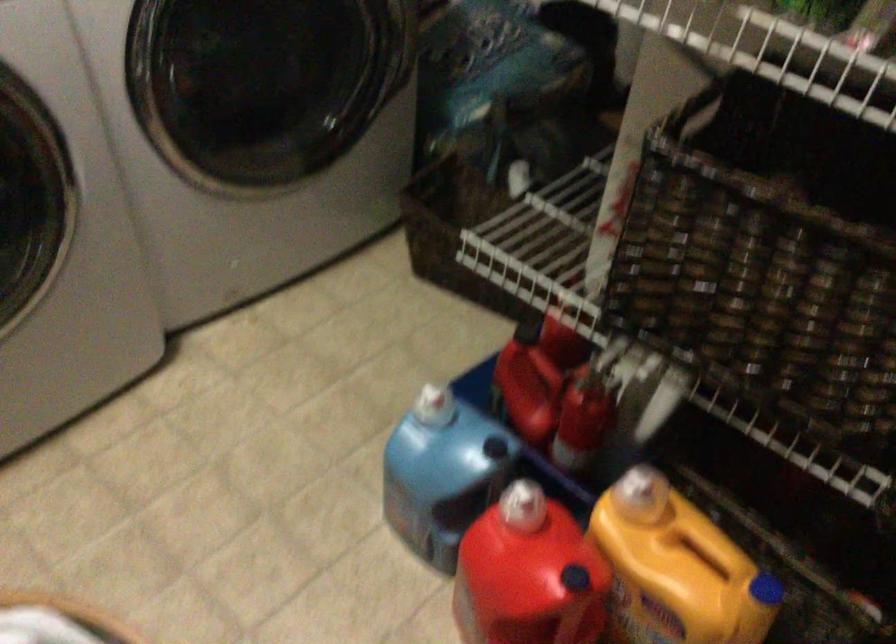
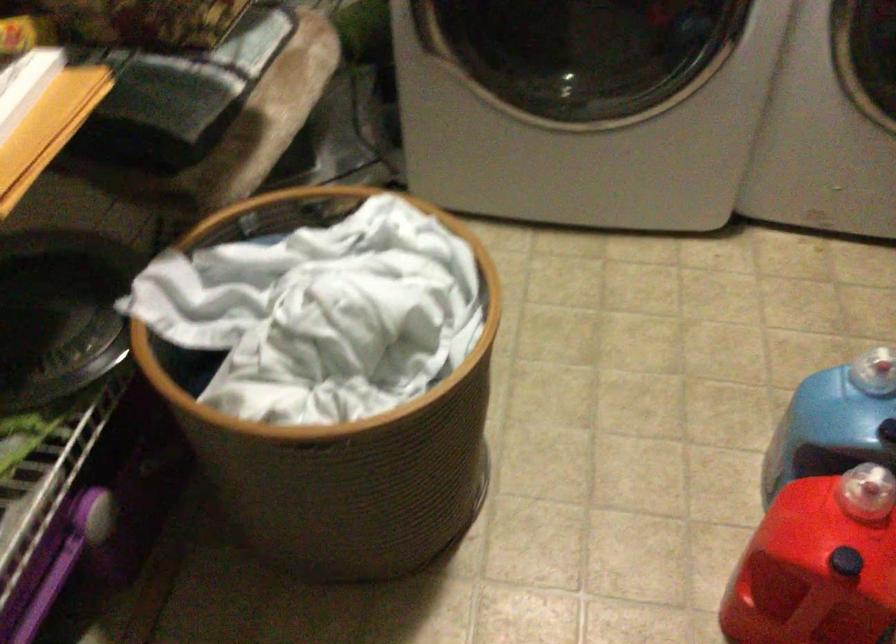
Where in the second image is the point corresponding to [519,503] from the first image?

(866, 491)